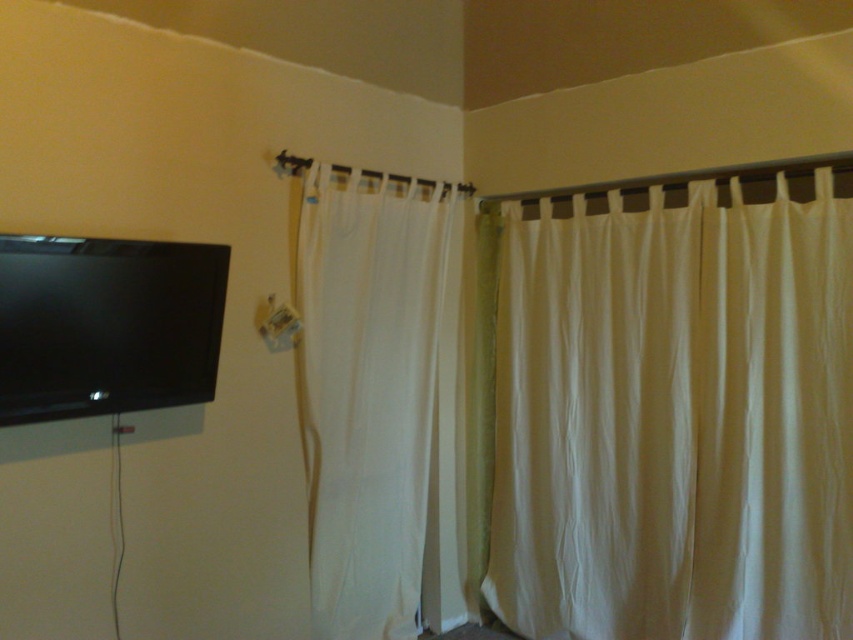
You are standing in the room and want to hang a small picture frame. The frame is 10 cm wide. You see the point marked at coordinates point [675,417]. Can you place the frame there without overlapping the white sheer curtain at upper right?

The point [675,417] indicates the location of the white sheer curtain at upper right. Placing a frame at this exact point would overlap with the curtain, so it is not advisable to place the frame there.